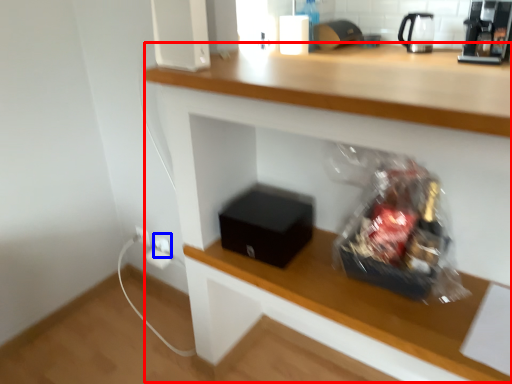
Question: Which object appears closest to the camera in this image, computer desk (highlighted by a red box) or electric outlet (highlighted by a blue box)?

Choices:
 (A) computer desk
 (B) electric outlet

Answer: (A)